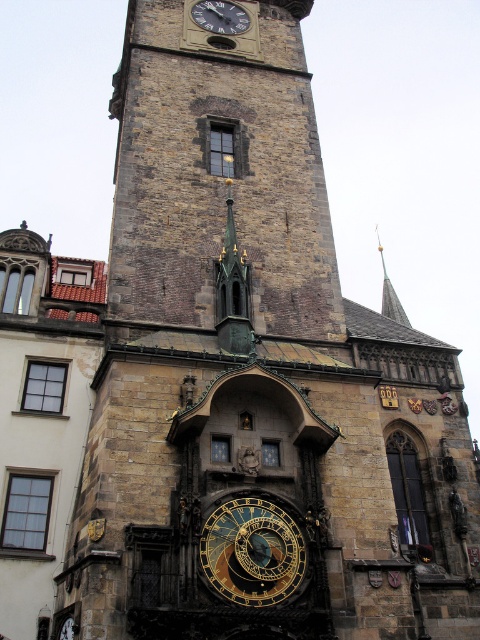
Between point (242, 566) and point (219, 10), which one is positioned in front?

Positioned in front is point (242, 566).

Is point (229, 570) positioned after point (204, 4)?

No, it is not.

This screenshot has height=640, width=480. Describe the element at coordinates (252, 552) in the screenshot. I see `gold metallic clock at center` at that location.

Find the location of a particular element. The height and width of the screenshot is (640, 480). gold metallic clock at center is located at coordinates (252, 552).

Which is more to the left, gold metallic clock at upper center or gold/brass spire at upper right?

From the viewer's perspective, gold metallic clock at upper center appears more on the left side.

Does point (223, 4) come in front of point (402, 316)?

No, it is behind (402, 316).

Where is `gold metallic clock at upper center`? The image size is (480, 640). gold metallic clock at upper center is located at coordinates tap(219, 17).

Does gold metallic clock at center appear on the right side of gold/brass spire at upper right?

No, gold metallic clock at center is not to the right of gold/brass spire at upper right.

Measure the distance between gold metallic clock at center and camera.

The distance of gold metallic clock at center from camera is 107.59 feet.

Describe the element at coordinates (252, 552) in the screenshot. The image size is (480, 640). I see `gold metallic clock at center` at that location.

The image size is (480, 640). Identify the location of gold metallic clock at center. (252, 552).